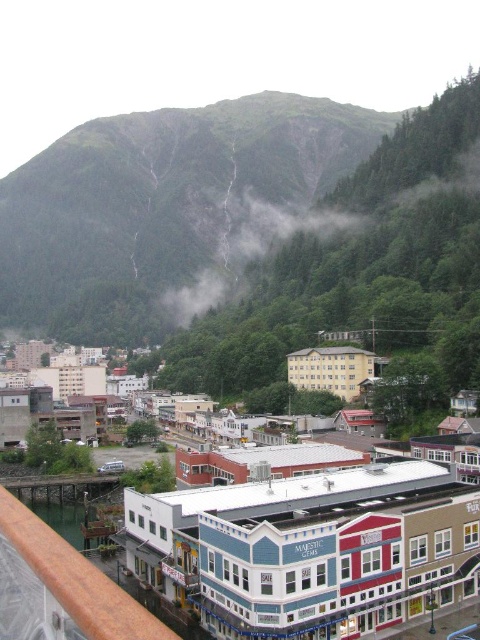
Question: Is multicolored painted building at center above foggy misty cloud at center?

Choices:
 (A) no
 (B) yes

Answer: (A)

Question: Which object appears closest to the camera in this image?

Choices:
 (A) multicolored painted building at center
 (B) foggy misty cloud at center

Answer: (A)

Question: Which of the following is the closest to the observer?

Choices:
 (A) multicolored painted building at center
 (B) foggy misty cloud at center

Answer: (A)

Question: Is multicolored painted building at center positioned behind foggy misty cloud at center?

Choices:
 (A) no
 (B) yes

Answer: (A)

Question: Does multicolored painted building at center appear under foggy misty cloud at center?

Choices:
 (A) no
 (B) yes

Answer: (B)

Question: Which of the following is the closest to the observer?

Choices:
 (A) multicolored painted building at center
 (B) foggy misty cloud at center

Answer: (A)